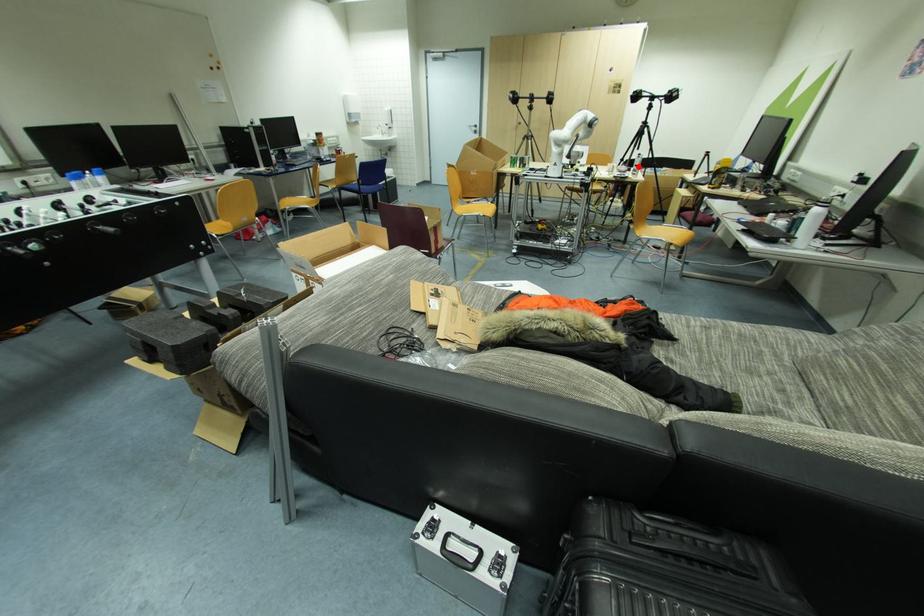
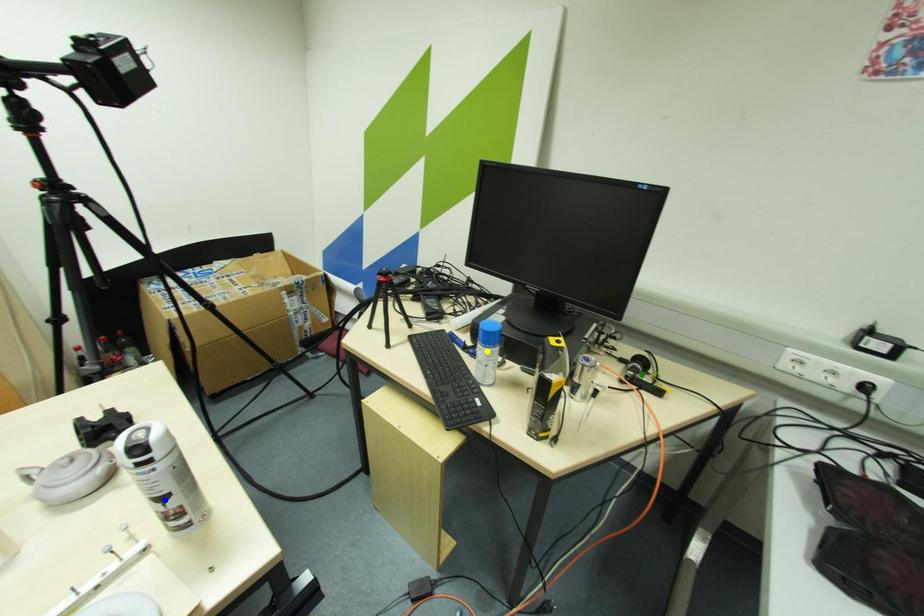
Question: I am providing you with two images of the same scene from different viewpoints. A red point is marked on the first image. You are given multiple points on the second image. Can you choose the point in image 2 that corresponds to the point in image 1?

Choices:
 (A) green point
 (B) blue point
 (C) yellow point

Answer: (B)